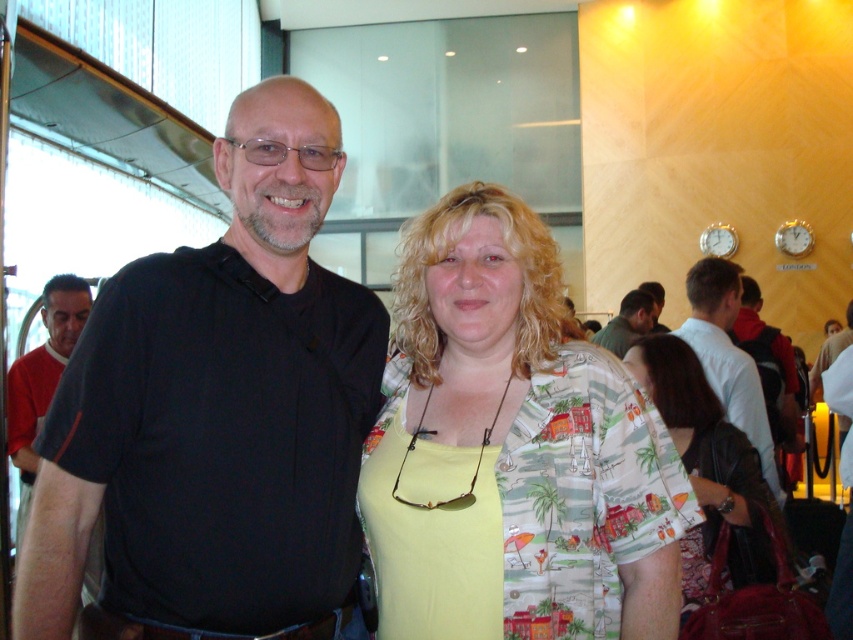
Which is below, red sweater at left or green fabric shirt at center?

red sweater at left is lower down.

Is point (83, 577) positioned behind point (606, 324)?

No.

The image size is (853, 640). In order to click on red sweater at left in this screenshot , I will do `click(41, 378)`.

Does black polo shirt at center have a lesser width compared to printed fabric shirt at center?

Yes.

Does black polo shirt at center have a larger size compared to printed fabric shirt at center?

Indeed, black polo shirt at center has a larger size compared to printed fabric shirt at center.

You are a GUI agent. You are given a task and a screenshot of the screen. Output one action in this format:
    pyautogui.click(x=<x>, y=<y>)
    Task: Click on the black polo shirt at center
    
    Given the screenshot: What is the action you would take?
    pyautogui.click(x=218, y=413)

Is point (706, 499) in front of point (80, 326)?

Yes, it is in front of point (80, 326).

Is printed fabric shirt at right below red sweater at left?

Yes, printed fabric shirt at right is below red sweater at left.

The width and height of the screenshot is (853, 640). Identify the location of printed fabric shirt at right. (708, 468).

This screenshot has width=853, height=640. In order to click on printed fabric shirt at right in this screenshot , I will do `click(708, 468)`.